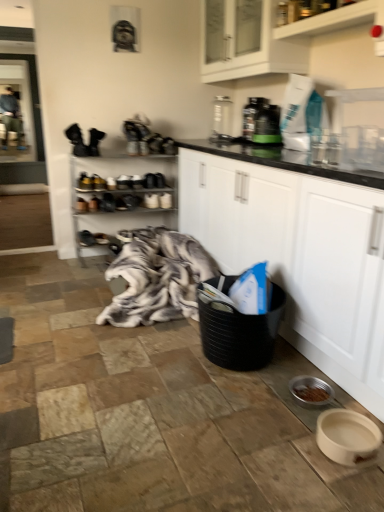
Question: Is green plastic bottle at upper center, marked as the 1th appliance in a right-to-left arrangement, at the left side of clear glass screen door at upper left?

Choices:
 (A) yes
 (B) no

Answer: (B)

Question: Does green plastic bottle at upper center, arranged as the 2th appliance when viewed from the left, come in front of clear glass screen door at upper left?

Choices:
 (A) no
 (B) yes

Answer: (B)

Question: Does green plastic bottle at upper center, marked as the first appliance in a front-to-back arrangement, have a greater width compared to clear glass screen door at upper left?

Choices:
 (A) yes
 (B) no

Answer: (A)

Question: Can we say green plastic bottle at upper center, the 2th appliance viewed from the back, lies outside clear glass screen door at upper left?

Choices:
 (A) no
 (B) yes

Answer: (B)

Question: Does green plastic bottle at upper center, marked as the 1th appliance in a right-to-left arrangement, have a lesser height compared to clear glass screen door at upper left?

Choices:
 (A) no
 (B) yes

Answer: (B)

Question: Is point (299, 56) closer or farther from the camera than point (322, 20)?

Choices:
 (A) farther
 (B) closer

Answer: (A)

Question: Considering the positions of white glossy cabinet at upper center, positioned as the first cabinetry in top-to-bottom order, and white glossy shelf at upper center, placed as the 1th shelf when sorted from right to left, in the image, is white glossy cabinet at upper center, positioned as the first cabinetry in top-to-bottom order, wider or thinner than white glossy shelf at upper center, placed as the 1th shelf when sorted from right to left,?

Choices:
 (A) thin
 (B) wide

Answer: (B)

Question: Do you think white glossy cabinet at upper center, positioned as the first cabinetry in top-to-bottom order, is within white glossy shelf at upper center, the 1th shelf in the front-to-back sequence, or outside of it?

Choices:
 (A) inside
 (B) outside

Answer: (B)

Question: Would you say white glossy cabinet at upper center, positioned as the first cabinetry in top-to-bottom order, is to the left or to the right of white glossy shelf at upper center, which is the 2th shelf from bottom to top, in the picture?

Choices:
 (A) left
 (B) right

Answer: (A)

Question: Is green plastic bottle at upper center, the 2th appliance viewed from the back, situated inside white matte cabinet at center, arranged as the second cabinetry when viewed from the top, or outside?

Choices:
 (A) outside
 (B) inside

Answer: (A)

Question: Visually, is green plastic bottle at upper center, the 2th appliance viewed from the back, positioned to the left or to the right of white matte cabinet at center, which is the 1th cabinetry from bottom to top?

Choices:
 (A) right
 (B) left

Answer: (B)

Question: Does point (268, 111) appear closer or farther from the camera than point (326, 336)?

Choices:
 (A) farther
 (B) closer

Answer: (A)

Question: Based on their sizes in the image, would you say green plastic bottle at upper center, marked as the 1th appliance in a right-to-left arrangement, is bigger or smaller than white matte cabinet at center, arranged as the second cabinetry when viewed from the top?

Choices:
 (A) small
 (B) big

Answer: (A)

Question: From the image's perspective, is metallic silver shoe rack at center, placed as the 2th shelf when sorted from front to back, above or below white glossy cabinet at upper center, positioned as the first cabinetry in top-to-bottom order?

Choices:
 (A) above
 (B) below

Answer: (B)

Question: In the image, is metallic silver shoe rack at center, which appears as the 1th shelf when ordered from the bottom, positioned in front of or behind white glossy cabinet at upper center, positioned as the first cabinetry in top-to-bottom order?

Choices:
 (A) front
 (B) behind

Answer: (B)